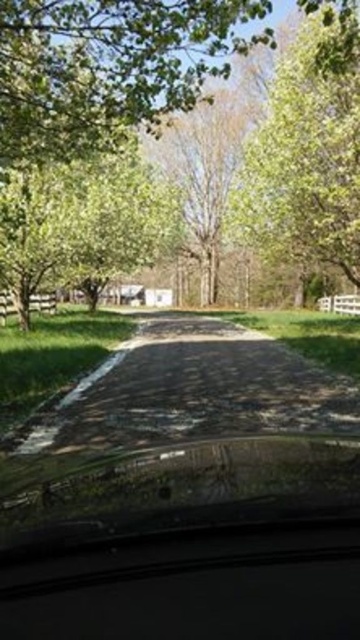
Between green leafy tree at center and dark asphalt driveway at center, which one appears on the left side from the viewer's perspective?

green leafy tree at center is more to the left.

Which of these two, green leafy tree at center or dark asphalt driveway at center, stands shorter?

Standing shorter between the two is dark asphalt driveway at center.

Does point (226, 28) come farther from viewer compared to point (65, 449)?

Yes, it is behind point (65, 449).

Locate an element on the screen. This screenshot has width=360, height=640. green leafy tree at center is located at coordinates (106, 67).

Is green leafy tree at center taller than green leafy tree at upper center?

Incorrect, green leafy tree at center's height is not larger of green leafy tree at upper center's.

Is point (164, 45) behind point (325, 120)?

That is False.

Locate an element on the screen. green leafy tree at center is located at coordinates [106, 67].

This screenshot has height=640, width=360. I want to click on green leafy tree at center, so [x=106, y=67].

Which is above, dark asphalt driveway at center or green leafy tree at upper center?

green leafy tree at upper center is higher up.

What do you see at coordinates (196, 388) in the screenshot?
I see `dark asphalt driveway at center` at bounding box center [196, 388].

Where is `dark asphalt driveway at center`? The image size is (360, 640). dark asphalt driveway at center is located at coordinates (196, 388).

Find the location of `dark asphalt driveway at center`. dark asphalt driveway at center is located at coordinates (196, 388).